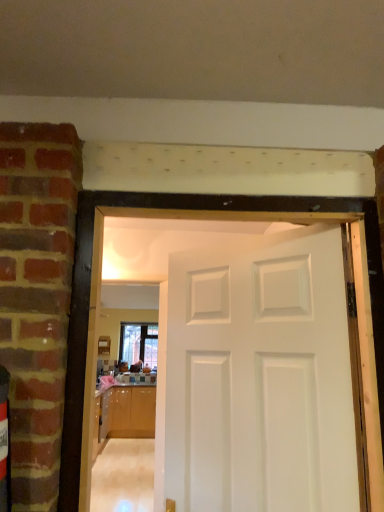
Locate an element on the screen. This screenshot has height=512, width=384. clear glass window at center is located at coordinates (139, 343).

What do you see at coordinates (132, 412) in the screenshot? I see `glossy wood cabinetry at lower left` at bounding box center [132, 412].

Where is `white painted wood door at center`? white painted wood door at center is located at coordinates (257, 375).

Consider the image. From the image's perspective, is glossy wood cabinetry at lower left on top of white painted wood door at center?

→ No, from the image's perspective, glossy wood cabinetry at lower left is not above white painted wood door at center.

Considering the relative positions of glossy wood cabinetry at lower left and white painted wood door at center in the image provided, is glossy wood cabinetry at lower left in front of white painted wood door at center?

No, glossy wood cabinetry at lower left is behind white painted wood door at center.

Is point (146, 430) farther from camera compared to point (205, 301)?

That is True.

From a real-world perspective, is glossy wood cabinetry at lower left under white painted wood door at center?

Yes, from a real-world perspective, glossy wood cabinetry at lower left is under white painted wood door at center.

Is glossy wood cabinetry at lower left looking in the opposite direction of clear glass window at center?

glossy wood cabinetry at lower left does not have its back to clear glass window at center.

Choose the correct answer: Is glossy wood cabinetry at lower left inside clear glass window at center or outside it?

glossy wood cabinetry at lower left is spatially situated outside clear glass window at center.

Is glossy wood cabinetry at lower left smaller than clear glass window at center?

Incorrect, glossy wood cabinetry at lower left is not smaller in size than clear glass window at center.

Is white painted wood door at center positioned far away from clear glass window at center?

Absolutely, white painted wood door at center is distant from clear glass window at center.

From the image's perspective, is white painted wood door at center above clear glass window at center?

Indeed, from the image's perspective, white painted wood door at center is shown above clear glass window at center.

Looking at this image, between white painted wood door at center and clear glass window at center, which one has smaller size?

clear glass window at center is smaller.

From a real-world perspective, between clear glass window at center and white painted wood door at center, who is vertically lower?

In real-world perspective, white painted wood door at center is lower.

Consider the image. Relative to white painted wood door at center, is clear glass window at center in front or behind?

clear glass window at center is positioned farther from the viewer than white painted wood door at center.

Is clear glass window at center at the right side of white painted wood door at center?

Incorrect, clear glass window at center is not on the right side of white painted wood door at center.

From the image's perspective, who appears lower, clear glass window at center or white painted wood door at center?

From the image's view, clear glass window at center is below.

Consider the image. Is clear glass window at center thinner than glossy wood cabinetry at lower left?

Yes.

Is clear glass window at center turned away from glossy wood cabinetry at lower left?

clear glass window at center does not have its back to glossy wood cabinetry at lower left.

Is point (122, 323) positioned behind point (124, 403)?

That is True.

From the picture: Considering the relative positions of clear glass window at center and glossy wood cabinetry at lower left in the image provided, is clear glass window at center to the left or to the right of glossy wood cabinetry at lower left?

Based on their positions, clear glass window at center is located to the left of glossy wood cabinetry at lower left.

Is white painted wood door at center bigger or smaller than glossy wood cabinetry at lower left?

Considering their sizes, white painted wood door at center takes up less space than glossy wood cabinetry at lower left.

Consider the image. From the image's perspective, which is above, white painted wood door at center or glossy wood cabinetry at lower left?

white painted wood door at center is shown above in the image.

Is white painted wood door at center in front of or behind glossy wood cabinetry at lower left in the image?

Visually, white painted wood door at center is located in front of glossy wood cabinetry at lower left.

Is white painted wood door at center positioned far away from glossy wood cabinetry at lower left?

Yes, white painted wood door at center and glossy wood cabinetry at lower left are quite far apart.

The height and width of the screenshot is (512, 384). In order to click on door located above the glossy wood cabinetry at lower left (from the image's perspective) in this screenshot , I will do `click(257, 375)`.

Where is `cabinetry below the clear glass window at center (from the image's perspective)`? cabinetry below the clear glass window at center (from the image's perspective) is located at coordinates (132, 412).

From the image, which object appears to be nearer to white painted wood door at center, clear glass window at center or glossy wood cabinetry at lower left?

glossy wood cabinetry at lower left.

Estimate the real-world distances between objects in this image. Which object is further from glossy wood cabinetry at lower left, clear glass window at center or white painted wood door at center?

Based on the image, white painted wood door at center appears to be further to glossy wood cabinetry at lower left.

From the image, which object appears to be farther from glossy wood cabinetry at lower left, white painted wood door at center or clear glass window at center?

white painted wood door at center lies further to glossy wood cabinetry at lower left than the other object.

Looking at this image, which object lies further to the anchor point white painted wood door at center, glossy wood cabinetry at lower left or clear glass window at center?

The object further to white painted wood door at center is clear glass window at center.

Estimate the real-world distances between objects in this image. Which object is closer to clear glass window at center, white painted wood door at center or glossy wood cabinetry at lower left?

glossy wood cabinetry at lower left.

Looking at the image, which one is located closer to clear glass window at center, glossy wood cabinetry at lower left or white painted wood door at center?

Among the two, glossy wood cabinetry at lower left is located nearer to clear glass window at center.

Find the location of a particular element. The image size is (384, 512). cabinetry positioned between white painted wood door at center and clear glass window at center from near to far is located at coordinates (132, 412).